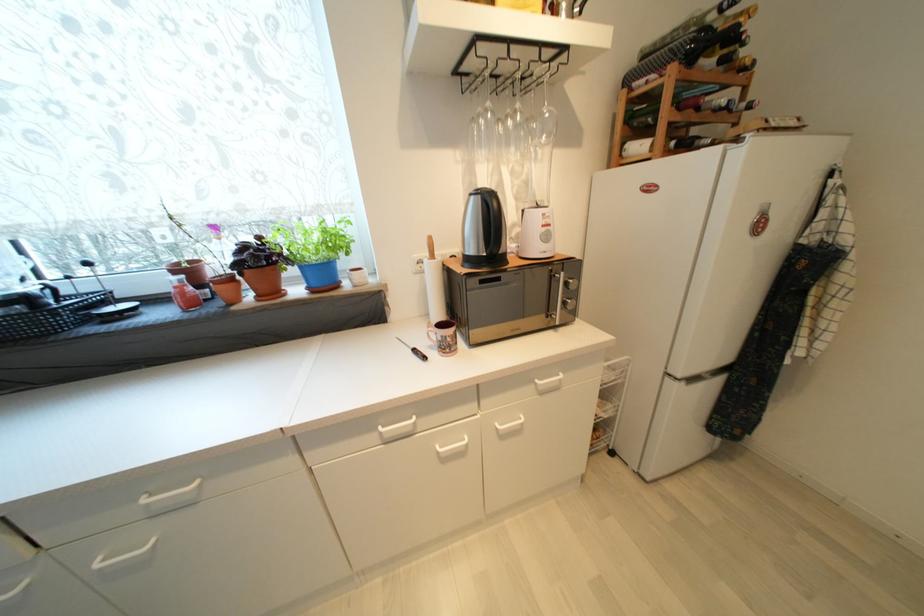
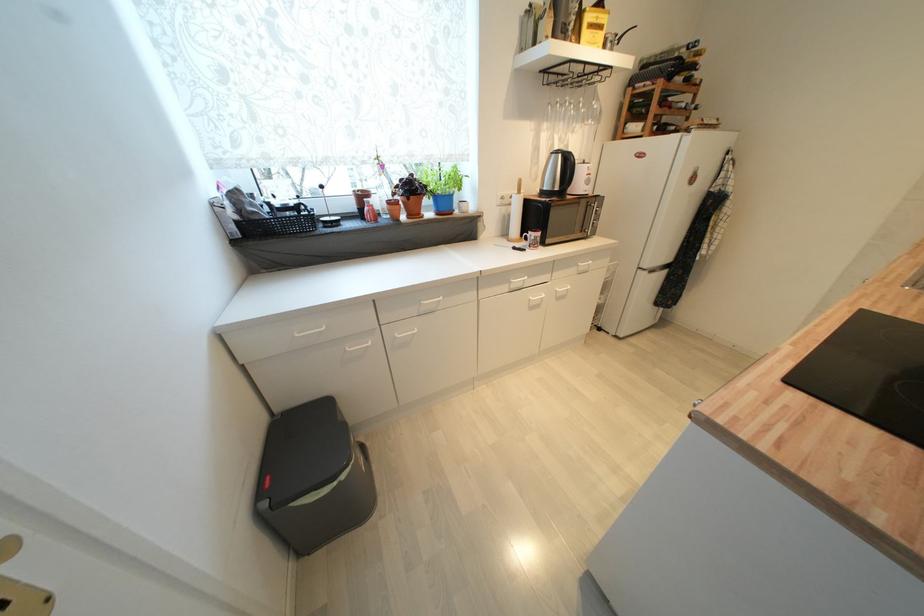
Find the pixel in the second image that matches point (444, 339) in the first image.

(538, 240)